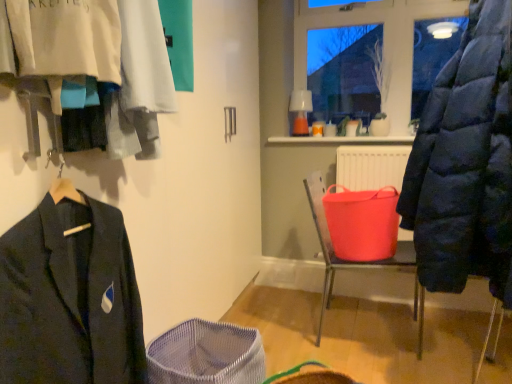
Question: Which is correct: rubberized plastic bucket at center is inside mesh fabric basket at lower center, or outside of it?

Choices:
 (A) outside
 (B) inside

Answer: (A)

Question: From a real-world perspective, is rubberized plastic bucket at center physically located above or below mesh fabric basket at lower center?

Choices:
 (A) below
 (B) above

Answer: (B)

Question: Which of these objects is positioned closest to the matte black jacket at left?

Choices:
 (A) transparent glass window at upper center
 (B) matte blue puffer coat at right
 (C) dark blue woolen suit at left
 (D) rubberized plastic bucket at center
 (E) mesh fabric basket at lower center

Answer: (C)

Question: Estimate the real-world distances between objects in this image. Which object is farther from the mesh fabric basket at lower center?

Choices:
 (A) dark blue woolen suit at left
 (B) rubberized plastic bucket at center
 (C) matte black jacket at left
 (D) matte blue puffer coat at right
 (E) transparent glass window at upper center

Answer: (E)